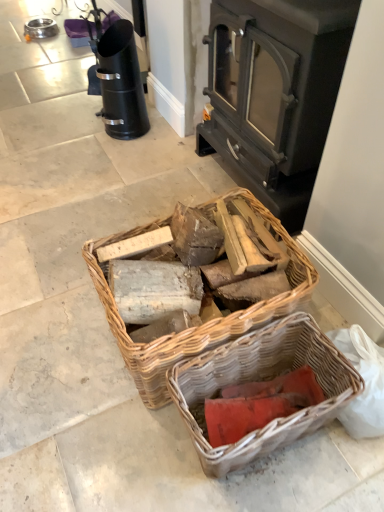
The height and width of the screenshot is (512, 384). Find the location of `free spot in front of woven wood basket at center, the first picnic basket viewed from the top`. free spot in front of woven wood basket at center, the first picnic basket viewed from the top is located at coordinates (171, 465).